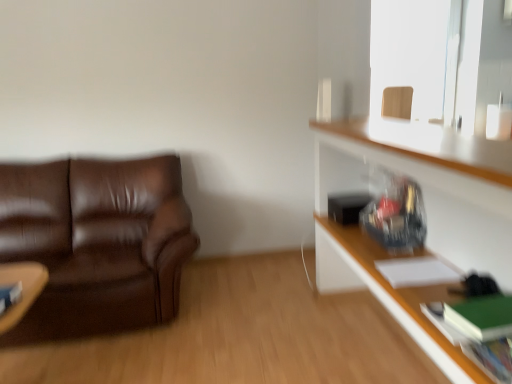
Describe the element at coordinates (490, 358) in the screenshot. This screenshot has width=512, height=384. I see `hardcover book at lower right, the 4th book from the back` at that location.

The width and height of the screenshot is (512, 384). Describe the element at coordinates (481, 317) in the screenshot. I see `green matte book at lower right, positioned as the 2th book in front-to-back order` at that location.

The width and height of the screenshot is (512, 384). Identify the location of wooden frame at upper right. (425, 56).

Locate an element on the screen. This screenshot has width=512, height=384. hardcover book at lower right, the 4th book from the back is located at coordinates (490, 358).

Is the depth of brown leather couch at left greater than that of green matte book at lower right, which appears as the 3th book when viewed from the left?

Yes, brown leather couch at left is behind green matte book at lower right, which appears as the 3th book when viewed from the left.

Which of these two, brown leather couch at left or green matte book at lower right, which is counted as the 3th book, starting from the back, is bigger?

Bigger between the two is brown leather couch at left.

Considering the sizes of objects brown leather couch at left and green matte book at lower right, which is counted as the 3th book, starting from the back, in the image provided, who is wider, brown leather couch at left or green matte book at lower right, which is counted as the 3th book, starting from the back,?

With larger width is brown leather couch at left.

Considering the positions of objects brown leather couch at left and green matte book at lower right, which appears as the 3th book when viewed from the left, in the image provided, who is more to the right, brown leather couch at left or green matte book at lower right, which appears as the 3th book when viewed from the left,?

green matte book at lower right, which appears as the 3th book when viewed from the left, is more to the right.

Is green matte book at lower right, which appears as the 3th book when viewed from the left, placed right next to wooden swivel chair at upper right?

No, green matte book at lower right, which appears as the 3th book when viewed from the left, is not in contact with wooden swivel chair at upper right.

In the scene shown: How distant is green matte book at lower right, the second book when ordered from right to left, from wooden swivel chair at upper right?

green matte book at lower right, the second book when ordered from right to left, is 6.54 feet from wooden swivel chair at upper right.

From a real-world perspective, relative to wooden swivel chair at upper right, is green matte book at lower right, the second book when ordered from right to left, vertically above or below?

green matte book at lower right, the second book when ordered from right to left, is below wooden swivel chair at upper right.

The image size is (512, 384). What are the coordinates of `book that is the 2nd object directly below the wooden frame at upper right (from a real-world perspective)` in the screenshot? It's located at (490, 358).

Which of these two, hardcover book at lower right, the 4th book from the back, or wooden frame at upper right, is wider?

Wider between the two is hardcover book at lower right, the 4th book from the back.

Looking at this image, are hardcover book at lower right, the 1th book viewed from the right, and wooden frame at upper right making contact?

There is a gap between hardcover book at lower right, the 1th book viewed from the right, and wooden frame at upper right.

Looking at this image, who is shorter, hardcover book at lower right, the 4th book from the back, or wooden frame at upper right?

hardcover book at lower right, the 4th book from the back, is shorter.

From the image's perspective, which is below, green matte book at lower right, which appears as the 3th book when viewed from the left, or wooden frame at upper right?

From the image's view, green matte book at lower right, which appears as the 3th book when viewed from the left, is below.

From a real-world perspective, is green matte book at lower right, positioned as the 2th book in front-to-back order, physically located above or below wooden frame at upper right?

In terms of real-world spatial position, green matte book at lower right, positioned as the 2th book in front-to-back order, is below wooden frame at upper right.

Is there a large distance between green matte book at lower right, the second book when ordered from right to left, and wooden frame at upper right?

Yes, green matte book at lower right, the second book when ordered from right to left, and wooden frame at upper right are located far from each other.

Identify the location of window screen behind the green matte book at lower right, the second book when ordered from right to left. Image resolution: width=512 pixels, height=384 pixels. (425, 56).

Is wooden shelf at right inside or outside of hardcover book at lower left, the fourth book from the right?

wooden shelf at right cannot be found inside hardcover book at lower left, the fourth book from the right.

Considering the relative sizes of wooden shelf at right and hardcover book at lower left, which is the second book from back to front, in the image provided, is wooden shelf at right taller than hardcover book at lower left, which is the second book from back to front,?

Indeed, wooden shelf at right has a greater height compared to hardcover book at lower left, which is the second book from back to front.

In terms of size, does wooden shelf at right appear bigger or smaller than hardcover book at lower left, which is the second book from back to front?

In the image, wooden shelf at right appears to be larger than hardcover book at lower left, which is the second book from back to front.

Can you tell me how much wooden shelf at right and white paper at upper right, which is counted as the 1th book, starting from the back, differ in facing direction?

wooden shelf at right and white paper at upper right, which is counted as the 1th book, starting from the back, are facing 2.08 degrees away from each other.

Considering the sizes of objects wooden shelf at right and white paper at upper right, which is counted as the 1th book, starting from the back, in the image provided, who is bigger, wooden shelf at right or white paper at upper right, which is counted as the 1th book, starting from the back,?

wooden shelf at right is bigger.

Find the location of a particular element. The width and height of the screenshot is (512, 384). shelf that appears above the white paper at upper right, which is counted as the 1th book, starting from the back (from the image's perspective) is located at coordinates (426, 212).

From a real-world perspective, who is located lower, wooden shelf at right or wooden frame at upper right?

wooden shelf at right is physically lower.

In the scene shown: Is wooden shelf at right taller or shorter than wooden frame at upper right?

In the image, wooden shelf at right appears to be taller than wooden frame at upper right.

Would you consider wooden shelf at right to be distant from wooden frame at upper right?

wooden shelf at right is positioned a significant distance from wooden frame at upper right.

Consider the image. Which object is thinner, wooden shelf at right or wooden frame at upper right?

wooden frame at upper right is thinner.

Where is `the 3rd book counting from the right of the brown leather couch at left`? This screenshot has width=512, height=384. the 3rd book counting from the right of the brown leather couch at left is located at coordinates (481, 317).

Find the location of a particular element. The image size is (512, 384). the 2nd book to the left of the wooden swivel chair at upper right, counting from the anchor's position is located at coordinates (481, 317).

From the picture: Based on their spatial positions, is wooden swivel chair at upper right or hardcover book at lower right, placed as the 1th book when sorted from front to back, closer to wooden shelf at right?

hardcover book at lower right, placed as the 1th book when sorted from front to back, is positioned closer to the anchor wooden shelf at right.

When comparing their distances from hardcover book at lower right, placed as the 1th book when sorted from front to back, does white paper at upper right, acting as the third book starting from the right, or green matte book at lower right, the second book when ordered from right to left, seem closer?

Among the two, green matte book at lower right, the second book when ordered from right to left, is located nearer to hardcover book at lower right, placed as the 1th book when sorted from front to back.

Considering their positions, is brown leather couch at left positioned further to hardcover book at lower right, the 1th book viewed from the right, than wooden frame at upper right?

Based on the image, wooden frame at upper right appears to be further to hardcover book at lower right, the 1th book viewed from the right.

In the scene shown: From the image, which object appears to be nearer to hardcover book at lower right, positioned as the 4th book in left-to-right order, wooden frame at upper right or wooden swivel chair at upper right?

wooden swivel chair at upper right.

Looking at the image, which one is located further to green matte book at lower right, which is counted as the 3th book, starting from the back, hardcover book at lower right, positioned as the 4th book in left-to-right order, or hardcover book at lower left, which is the third book in front-to-back order?

The object further to green matte book at lower right, which is counted as the 3th book, starting from the back, is hardcover book at lower left, which is the third book in front-to-back order.

Which object lies further to the anchor point white paper at upper right, the 2th book viewed from the left, wooden shelf at right or brown leather couch at left?

brown leather couch at left.

Which object lies further to the anchor point brown leather couch at left, wooden frame at upper right or hardcover book at lower left, the fourth book from the right?

wooden frame at upper right lies further to brown leather couch at left than the other object.

Estimate the real-world distances between objects in this image. Which object is closer to wooden swivel chair at upper right, green matte book at lower right, which appears as the 3th book when viewed from the left, or brown leather couch at left?

Among the two, green matte book at lower right, which appears as the 3th book when viewed from the left, is located nearer to wooden swivel chair at upper right.

Locate an element on the screen. This screenshot has height=384, width=512. book situated between brown leather couch at left and white paper at upper right, which is counted as the 4th book, starting from the front, from left to right is located at coordinates (9, 296).

Where is `shelf between hardcover book at lower left, which is the second book from back to front, and hardcover book at lower right, the 1th book viewed from the right, from left to right`? The image size is (512, 384). shelf between hardcover book at lower left, which is the second book from back to front, and hardcover book at lower right, the 1th book viewed from the right, from left to right is located at coordinates (426, 212).

Image resolution: width=512 pixels, height=384 pixels. I want to click on swivel chair positioned between white paper at upper right, the 2th book viewed from the left, and wooden frame at upper right from near to far, so click(397, 102).

You are a GUI agent. You are given a task and a screenshot of the screen. Output one action in this format:
    pyautogui.click(x=<x>, y=<y>)
    Task: Click on the shelf between brown leather couch at left and hardcover book at lower right, positioned as the 4th book in left-to-right order
    Image resolution: width=512 pixels, height=384 pixels.
    Given the screenshot: What is the action you would take?
    pyautogui.click(x=426, y=212)